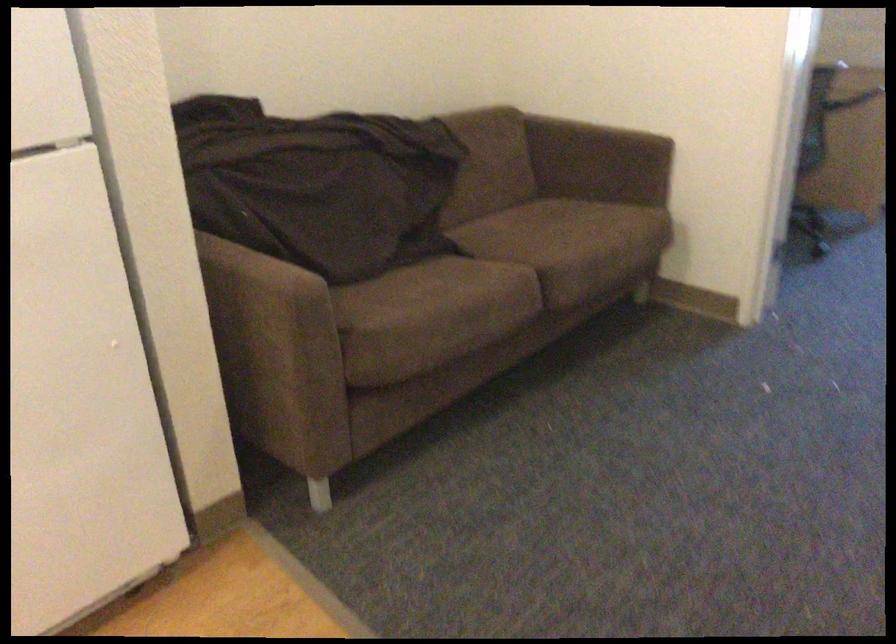
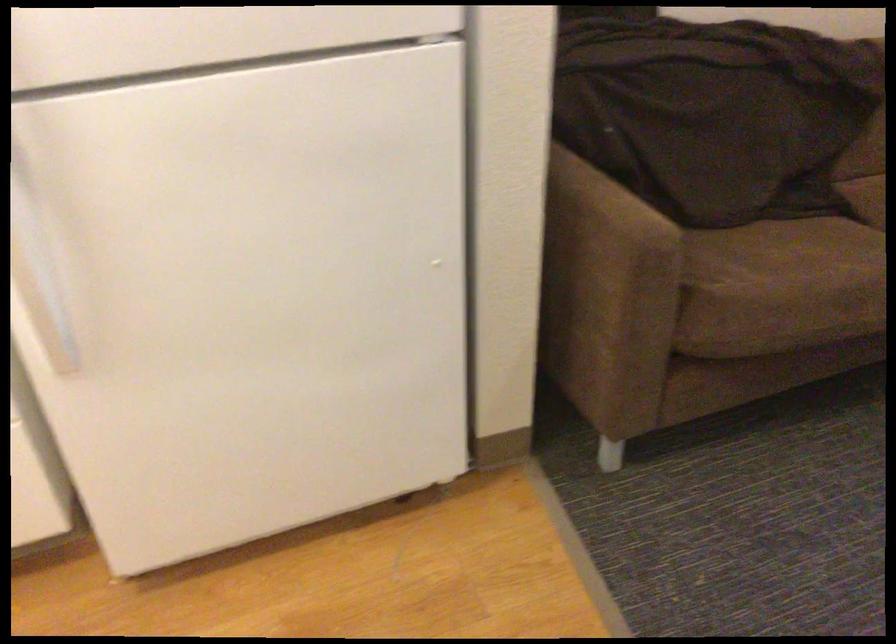
Question: Based on the continuous images, in which direction is the camera rotating? Reply with the corresponding letter.

Choices:
 (A) Left
 (B) Right
 (C) Up
 (D) Down

Answer: (A)